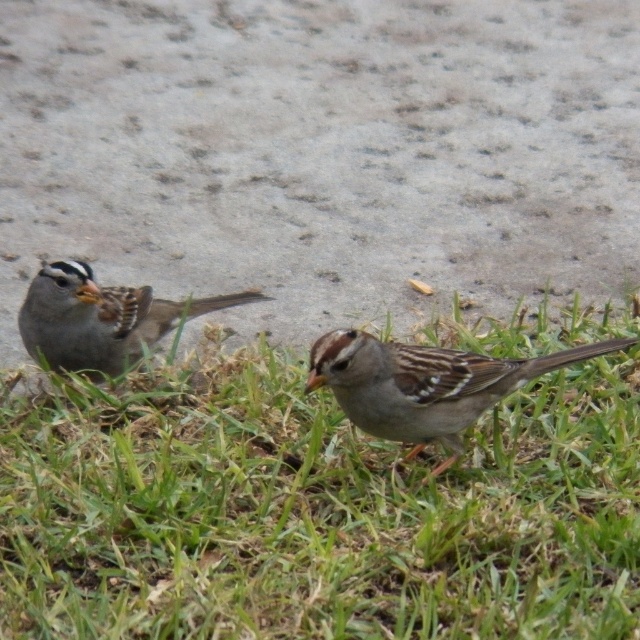
Question: Which of the following is the farthest from the observer?

Choices:
 (A) brown speckled sparrow at left
 (B) brown speckled sparrow at center

Answer: (A)

Question: Can you confirm if green grass at lower center is positioned above brown speckled sparrow at center?

Choices:
 (A) yes
 (B) no

Answer: (B)

Question: Can you confirm if brown speckled sparrow at center is thinner than brown speckled sparrow at left?

Choices:
 (A) yes
 (B) no

Answer: (B)

Question: Is green grass at lower center bigger than brown speckled sparrow at center?

Choices:
 (A) no
 (B) yes

Answer: (B)

Question: Which of the following is the farthest from the observer?

Choices:
 (A) green grass at lower center
 (B) brown speckled sparrow at left
 (C) brown speckled sparrow at center

Answer: (B)

Question: Which object is the farthest from the brown speckled sparrow at center?

Choices:
 (A) green grass at lower center
 (B) brown speckled sparrow at left

Answer: (B)